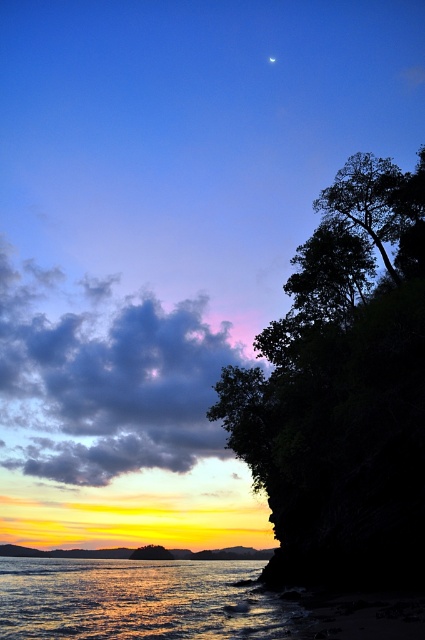
You are standing on the beach and see the shiny reflective water at lower left and the green leafy tree at lower center. Which object is wider from your perspective?

The shiny reflective water at lower left might be wider than the green leafy tree at lower center according to the description.

You are standing at the point closest to the horizon in this coastal scene. Which of the two points, point (322,241) or point (269,58), is closer to you?

Point (322,241) is in front of point (269,58), so it is closer to you.

You are standing on the beach and see the shiny reflective water at lower left and the green leafy tree at lower center. Which object is closer to your right side?

The shiny reflective water at lower left is positioned on the right side of green leafy tree at lower center, so it is closer to your right side.